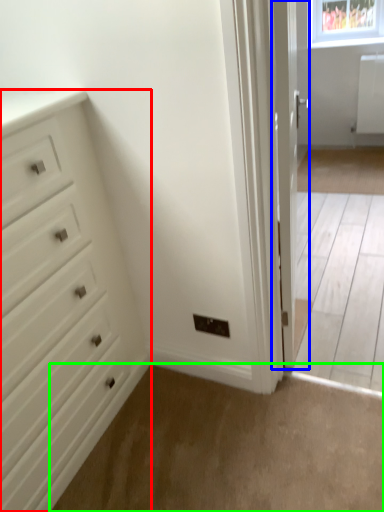
Question: Which object is positioned farthest from chest of drawers (highlighted by a red box)? Select from door (highlighted by a blue box) and plain (highlighted by a green box).

Choices:
 (A) door
 (B) plain

Answer: (A)